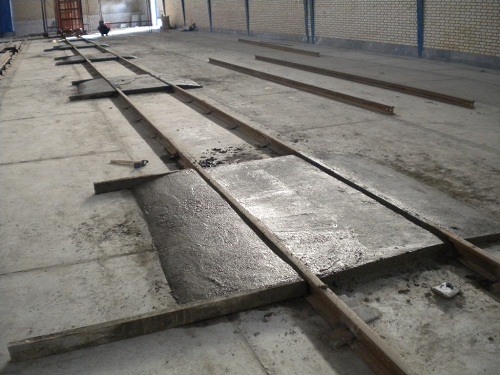
You are a GUI agent. You are given a task and a screenshot of the screen. Output one action in this format:
    pyautogui.click(x=<x>, y=<y>)
    Task: Click on the brick wall
    The image size is (500, 375).
    Given the screenshot: What is the action you would take?
    pyautogui.click(x=460, y=25), pyautogui.click(x=350, y=22), pyautogui.click(x=263, y=20), pyautogui.click(x=230, y=14), pyautogui.click(x=198, y=11), pyautogui.click(x=169, y=10), pyautogui.click(x=92, y=7), pyautogui.click(x=28, y=8)